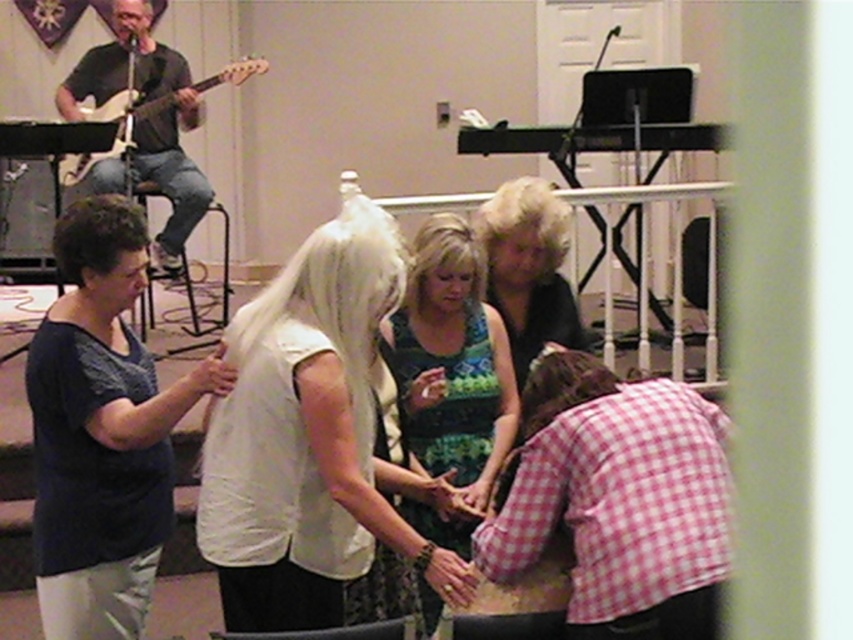
Question: Among these objects, which one is farthest from the camera?

Choices:
 (A) pink checkered shirt at lower right
 (B) matte black guitar at upper left

Answer: (B)

Question: Estimate the real-world distances between objects in this image. Which object is closer to the black silky dress at center?

Choices:
 (A) matte electric guitar at upper left
 (B) matte black guitar at upper left

Answer: (A)

Question: Which of these objects is positioned closest to the white matte veil at center?

Choices:
 (A) pink checkered shirt at lower right
 (B) matte black guitar at upper left
 (C) matte electric guitar at upper left

Answer: (A)

Question: From the image, what is the correct spatial relationship of green textured dress at center in relation to matte electric guitar at upper left?

Choices:
 (A) left
 (B) right

Answer: (B)

Question: In this image, where is pink checkered shirt at lower right located relative to dark blue fabric shirt at left?

Choices:
 (A) above
 (B) below

Answer: (B)

Question: Is white matte veil at center to the right of dark blue fabric shirt at left from the viewer's perspective?

Choices:
 (A) yes
 (B) no

Answer: (A)